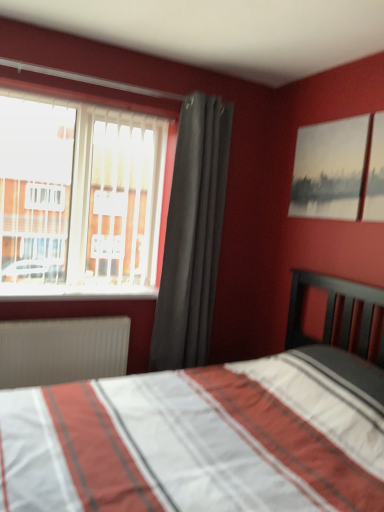
This screenshot has width=384, height=512. Find the location of `empty space that is ontop of transparent glass window at upper left (from a real-world perspective)`. empty space that is ontop of transparent glass window at upper left (from a real-world perspective) is located at coordinates (83, 97).